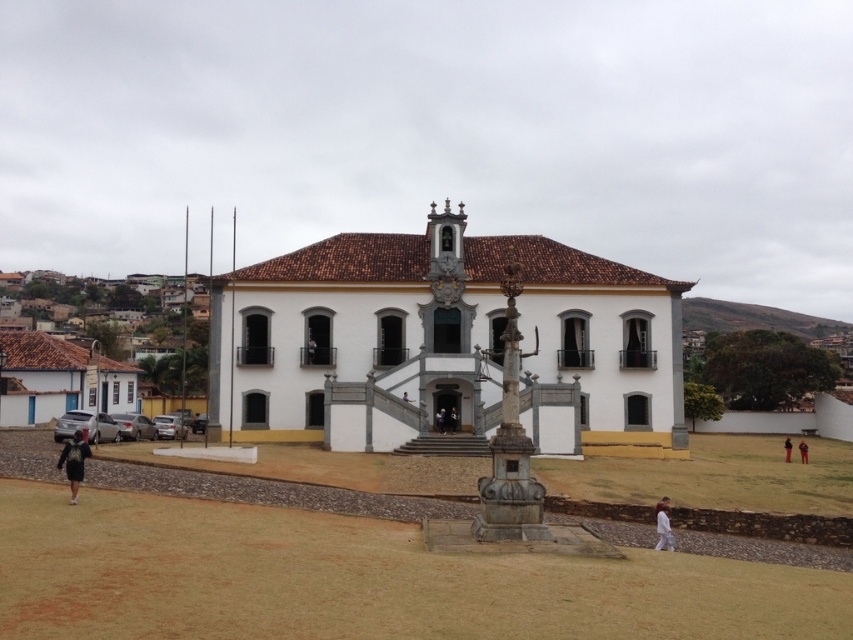
What is the position of the white fabric at lower right relative to the white fabric person at center?

The white fabric at lower right is positioned to the right of the white fabric person at center.

You are a photographer planning to take a group photo of the white fabric person at center and the white fabric at lower right in front of the colonial building. Considering their sizes, which subject should you position closer to the camera to ensure both appear proportionally sized in the photo?

The white fabric at lower right is larger in size than the white fabric person at center, so to make them appear proportionally sized in the photo, you should position the white fabric person at center closer to the camera and the white fabric at lower right farther away.

You are a visitor approaching the colonial building and see the dark gray backpack at lower left and the white fabric pants at lower right. Which object is nearer to you as you stand at the entrance?

The dark gray backpack at lower left is closer to the viewer than the white fabric pants at lower right, so the dark gray backpack at lower left is nearer to you as you stand at the entrance.